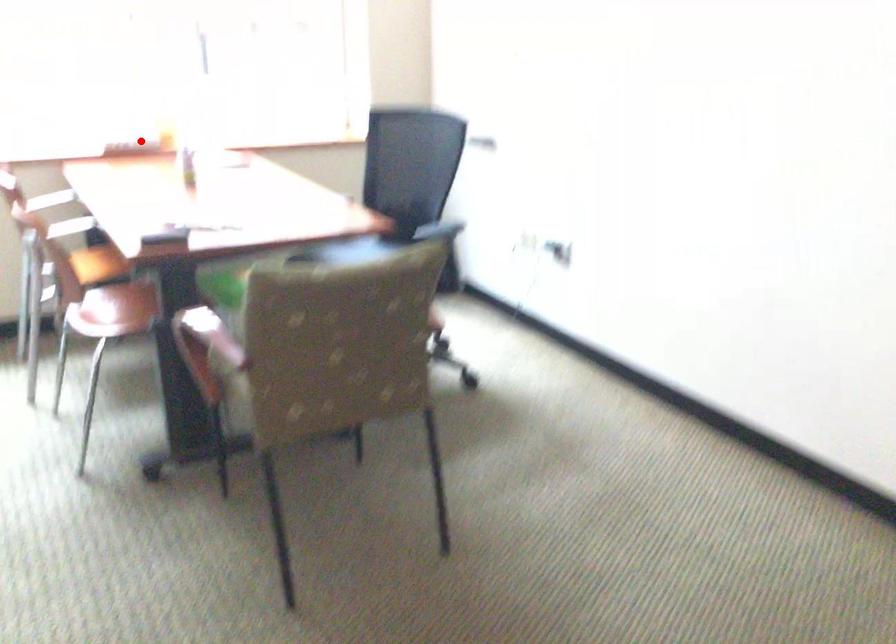
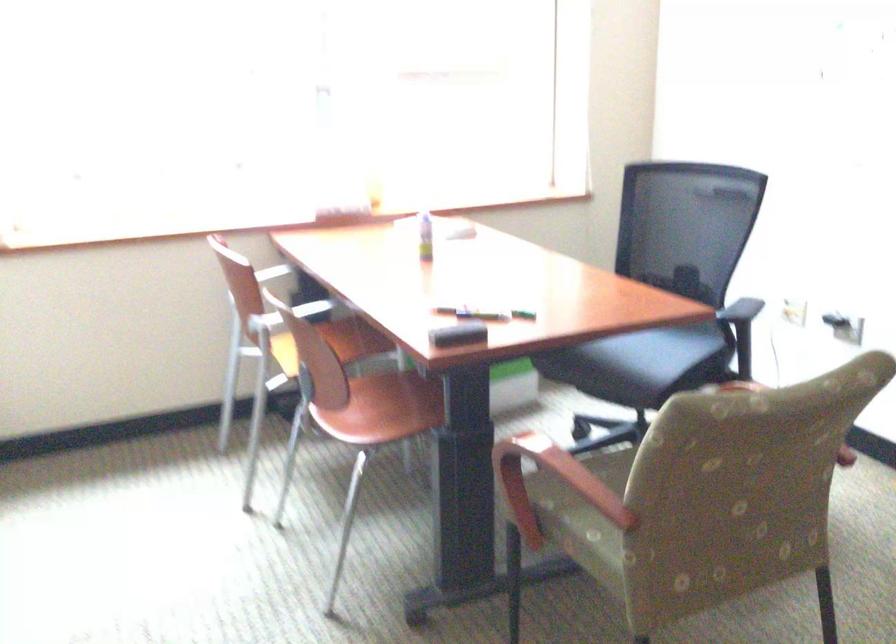
Where in the second image is the point corresponding to the highlighted location from the first image?

(346, 214)